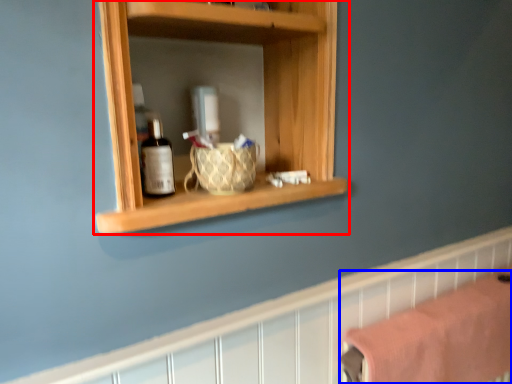
Question: Which of the following is the closest to the observer, shelf (highlighted by a red box) or bath towel (highlighted by a blue box)?

Choices:
 (A) shelf
 (B) bath towel

Answer: (A)